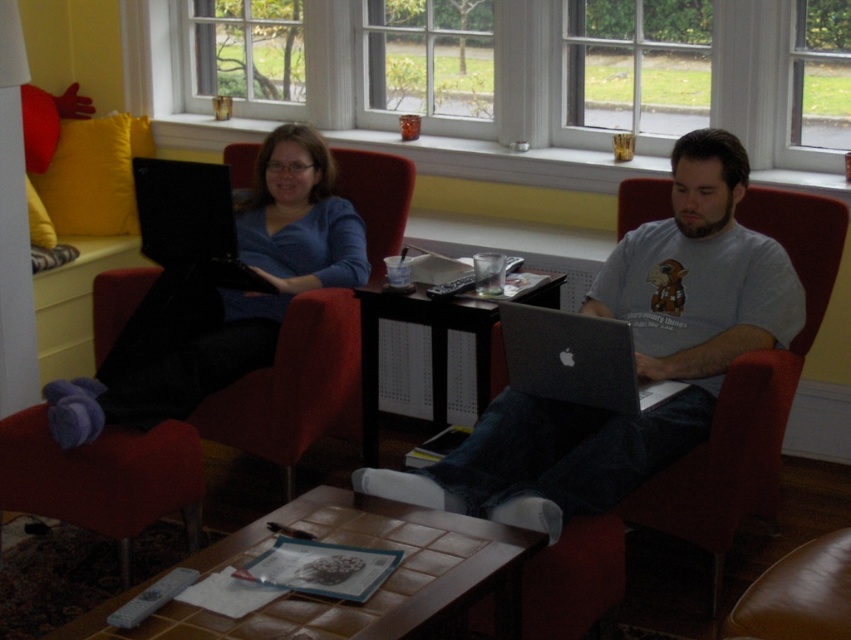
You are sitting in the red fabric chair at center and want to place your coffee mug on the brown tile table at center. Is the table within easy reach from your current position?

The brown tile table at center is in front of the red fabric chair at center, so it should be within easy reach for placing the coffee mug.